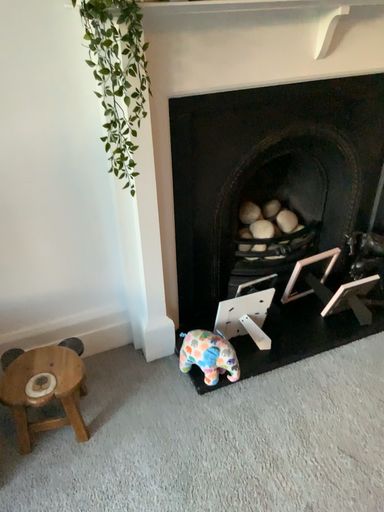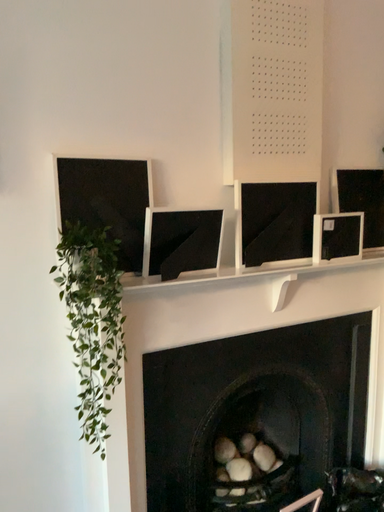
Question: How did the camera likely rotate when shooting the video?

Choices:
 (A) rotated downward
 (B) rotated upward

Answer: (B)